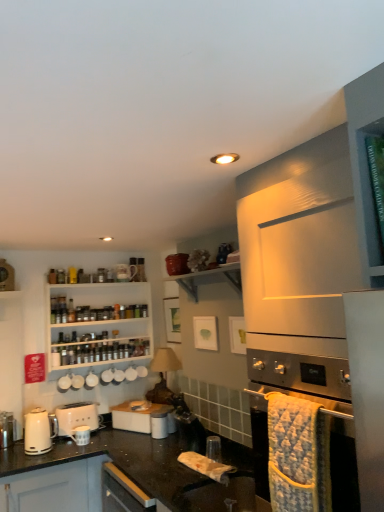
Describe the element at coordinates (300, 376) in the screenshot. The width and height of the screenshot is (384, 512). I see `stainless steel oven at lower right` at that location.

Measure the distance between white glossy shelf at upper center and camera.

They are 7.21 feet apart.

This screenshot has width=384, height=512. Describe the element at coordinates (98, 325) in the screenshot. I see `white wooden shelves at upper left` at that location.

I want to click on white matte toaster at lower left, which is the 2th kitchen appliance from front to back, so click(76, 417).

At what (x,y) coordinates should I click in order to perform the action: click on stainless steel oven at lower right. Please return your answer as a coordinate pair (x, y). This screenshot has height=512, width=384. Looking at the image, I should click on (300, 376).

Can you confirm if stainless steel oven at lower right is taller than white glossy shelf at upper center?

Yes, stainless steel oven at lower right is taller than white glossy shelf at upper center.

Between point (347, 490) and point (189, 277), which one is positioned in front?

Positioned in front is point (347, 490).

From the image's perspective, who appears lower, stainless steel oven at lower right or white glossy shelf at upper center?

stainless steel oven at lower right is shown below in the image.

Can we say stainless steel oven at lower right lies outside white glossy shelf at upper center?

stainless steel oven at lower right lies outside white glossy shelf at upper center's area.

Could black granite countertop at lower center be considered to be inside white glossy toaster at center?

Actually, black granite countertop at lower center is outside white glossy toaster at center.

Considering the relative sizes of white glossy toaster at center and black granite countertop at lower center in the image provided, is white glossy toaster at center wider than black granite countertop at lower center?

No.

Is white glossy toaster at center bigger or smaller than black granite countertop at lower center?

In the image, white glossy toaster at center appears to be smaller than black granite countertop at lower center.

Is white glossy toaster at center looking in the opposite direction of black granite countertop at lower center?

No, white glossy toaster at center's orientation is not away from black granite countertop at lower center.

From the image's perspective, which kitchen appliance is the 1st one below the white glossy shelf at upper center? Please provide its 2D coordinates.

[(38, 432)]

Between white glossy electric kettle at lower left, arranged as the 2th kitchen appliance when viewed from the back, and white glossy shelf at upper center, which one appears on the left side from the viewer's perspective?

white glossy electric kettle at lower left, arranged as the 2th kitchen appliance when viewed from the back.

From a real-world perspective, is white glossy electric kettle at lower left, arranged as the 2th kitchen appliance when viewed from the back, above or below white glossy shelf at upper center?

white glossy electric kettle at lower left, arranged as the 2th kitchen appliance when viewed from the back, is situated lower than white glossy shelf at upper center in the real world.

Does point (32, 444) appear closer or farther from the camera than point (232, 280)?

Point (32, 444) is farther from the camera than point (232, 280).

Based on their positions, is black granite countertop at lower center located to the left or right of white glossy toaster at center?

Based on their positions, black granite countertop at lower center is located to the left of white glossy toaster at center.

At what (x,y) coordinates should I click in order to perform the action: click on countertop located in front of the white glossy toaster at center. Please return your answer as a coordinate pair (x, y). The width and height of the screenshot is (384, 512). Looking at the image, I should click on (123, 472).

From the image's perspective, is black granite countertop at lower center located above white glossy toaster at center?

No, from the image's perspective, black granite countertop at lower center is not over white glossy toaster at center.

Is white matte toaster at lower left, which is the 1th kitchen appliance from back to front, inside the boundaries of stainless steel oven at lower right, or outside?

white matte toaster at lower left, which is the 1th kitchen appliance from back to front, cannot be found inside stainless steel oven at lower right.

Who is shorter, white matte toaster at lower left, which is the 1th kitchen appliance from back to front, or stainless steel oven at lower right?

With less height is white matte toaster at lower left, which is the 1th kitchen appliance from back to front.

Is the depth of white matte toaster at lower left, which is the 1th kitchen appliance from back to front, greater than that of stainless steel oven at lower right?

Yes, white matte toaster at lower left, which is the 1th kitchen appliance from back to front, is further from the camera.

How different are the orientations of white matte toaster at lower left, which is the 2th kitchen appliance from front to back, and stainless steel oven at lower right in degrees?

They differ by 90.4 degrees in their facing directions.

Which of these two, white glossy shelf at upper center or white glossy toaster at center, is wider?

white glossy toaster at center.

From the image's perspective, which object appears higher, white glossy shelf at upper center or white glossy toaster at center?

white glossy shelf at upper center, from the image's perspective.

Do you think white glossy shelf at upper center is within white glossy toaster at center, or outside of it?

white glossy shelf at upper center lies outside white glossy toaster at center.

Does point (184, 281) come behind point (154, 407)?

No, it is in front of (154, 407).

Is white glossy toaster at center far from white wooden shelves at upper left?

No, white glossy toaster at center is not far from white wooden shelves at upper left.

Is white glossy toaster at center smaller than white wooden shelves at upper left?

Yes, white glossy toaster at center is smaller than white wooden shelves at upper left.

Between white glossy toaster at center and white wooden shelves at upper left, which one is positioned in front?

Positioned in front is white glossy toaster at center.

The image size is (384, 512). In order to click on home appliance below the white glossy shelf at upper center (from the image's perspective) in this screenshot , I will do click(300, 376).

Find the location of a particular element. The width and height of the screenshot is (384, 512). appliance positioned vertically above the black granite countertop at lower center (from a real-world perspective) is located at coordinates (135, 417).

From the image, which object appears to be farther from white matte toaster at lower left, which is the 2th kitchen appliance from front to back, white glossy shelf at upper center or white glossy toaster at center?

Based on the image, white glossy shelf at upper center appears to be further to white matte toaster at lower left, which is the 2th kitchen appliance from front to back.

Based on their spatial positions, is white matte toaster at lower left, which is the 1th kitchen appliance from back to front, or white glossy shelf at upper center closer to white wooden shelves at upper left?

white matte toaster at lower left, which is the 1th kitchen appliance from back to front, is positioned closer to the anchor white wooden shelves at upper left.

Looking at this image, considering their positions, is white glossy toaster at center positioned further to white glossy shelf at upper center than white glossy electric kettle at lower left, placed as the 1th kitchen appliance when sorted from front to back?

Based on the image, white glossy electric kettle at lower left, placed as the 1th kitchen appliance when sorted from front to back, appears to be further to white glossy shelf at upper center.

Looking at the image, which one is located closer to black granite countertop at lower center, white wooden shelves at upper left or white matte toaster at lower left, which is the 2th kitchen appliance from front to back?

Among the two, white matte toaster at lower left, which is the 2th kitchen appliance from front to back, is located nearer to black granite countertop at lower center.

From the image, which object appears to be farther from white wooden shelves at upper left, white matte toaster at lower left, which is the 2th kitchen appliance from front to back, or white glossy electric kettle at lower left, placed as the 1th kitchen appliance when sorted from front to back?

white glossy electric kettle at lower left, placed as the 1th kitchen appliance when sorted from front to back, is positioned further to the anchor white wooden shelves at upper left.

From the image, which object appears to be farther from black granite countertop at lower center, white matte toaster at lower left, which is the 1th kitchen appliance from back to front, or white wooden shelves at upper left?

white wooden shelves at upper left is further to black granite countertop at lower center.

When comparing their distances from white glossy shelf at upper center, does stainless steel oven at lower right or white glossy toaster at center seem further?

stainless steel oven at lower right lies further to white glossy shelf at upper center than the other object.

Considering their positions, is white wooden shelves at upper left positioned closer to white glossy toaster at center than stainless steel oven at lower right?

white wooden shelves at upper left lies closer to white glossy toaster at center than the other object.

Image resolution: width=384 pixels, height=512 pixels. In order to click on shelf between stainless steel oven at lower right and black granite countertop at lower center along the z-axis in this screenshot , I will do `click(208, 278)`.

I want to click on shelf positioned between stainless steel oven at lower right and white glossy electric kettle at lower left, placed as the 1th kitchen appliance when sorted from front to back, from near to far, so click(208, 278).

What are the coordinates of `countertop between stainless steel oven at lower right and white matte toaster at lower left, which is the 2th kitchen appliance from front to back, along the z-axis` in the screenshot? It's located at (123, 472).

The image size is (384, 512). I want to click on cabinetry between white glossy shelf at upper center and black granite countertop at lower center from top to bottom, so click(98, 325).